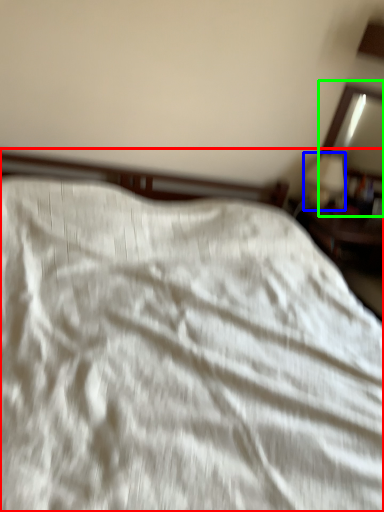
Question: Based on their relative distances, which object is nearer to bed (highlighted by a red box)? Choose from table lamp (highlighted by a blue box) and mirror (highlighted by a green box).

Choices:
 (A) table lamp
 (B) mirror

Answer: (A)